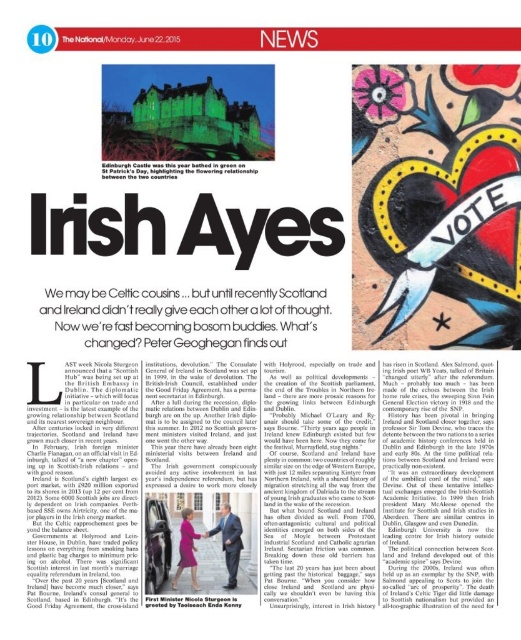
Question: Does smooth leather shoes at lower center appear on the left side of matte purple dress at center?

Choices:
 (A) yes
 (B) no

Answer: (B)

Question: Considering the relative positions of vivid acrylic heart at center and matte purple dress at center in the image provided, where is vivid acrylic heart at center located with respect to matte purple dress at center?

Choices:
 (A) above
 (B) below

Answer: (A)

Question: Which point is farther to the camera?

Choices:
 (A) click(x=390, y=282)
 (B) click(x=229, y=554)

Answer: (B)

Question: Is vivid acrylic heart at center closer to the viewer compared to smooth leather shoes at lower center?

Choices:
 (A) no
 (B) yes

Answer: (B)

Question: Among these objects, which one is farthest from the camera?

Choices:
 (A) smooth leather shoes at lower center
 (B) vivid acrylic heart at center
 (C) matte purple dress at center

Answer: (C)

Question: Which of the following is the closest to the observer?

Choices:
 (A) (183, 532)
 (B) (455, 84)

Answer: (A)